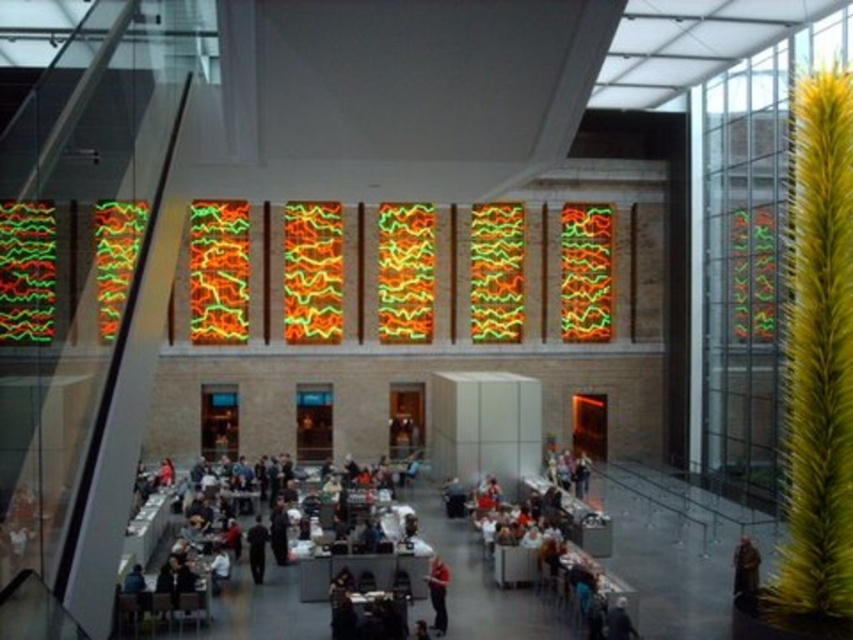
Question: Is the position of matte orange shirt at center more distant than that of dark blue fabric at center?

Choices:
 (A) no
 (B) yes

Answer: (A)

Question: Can you confirm if dark gray suit at center is thinner than dark blue fabric at center?

Choices:
 (A) no
 (B) yes

Answer: (A)

Question: Which object is closer to the camera taking this photo?

Choices:
 (A) dark blue fabric at center
 (B) matte orange shirt at center

Answer: (B)

Question: Is dark gray suit at center to the right of dark blue fabric at center from the viewer's perspective?

Choices:
 (A) no
 (B) yes

Answer: (B)

Question: Which object appears farthest from the camera in this image?

Choices:
 (A) dark blue fabric at center
 (B) matte orange shirt at center
 (C) dark gray suit at center

Answer: (A)

Question: Which point is farther to the camera?

Choices:
 (A) (257, 547)
 (B) (444, 609)
 (C) (379, 632)

Answer: (A)